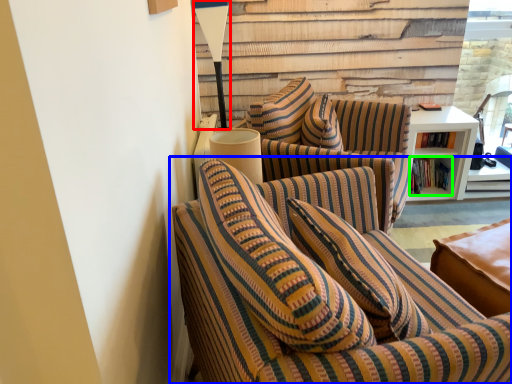
Question: Considering the real-world distances, which object is farthest from table lamp (highlighted by a red box)? studio couch (highlighted by a blue box) or book (highlighted by a green box)?

Choices:
 (A) studio couch
 (B) book

Answer: (A)